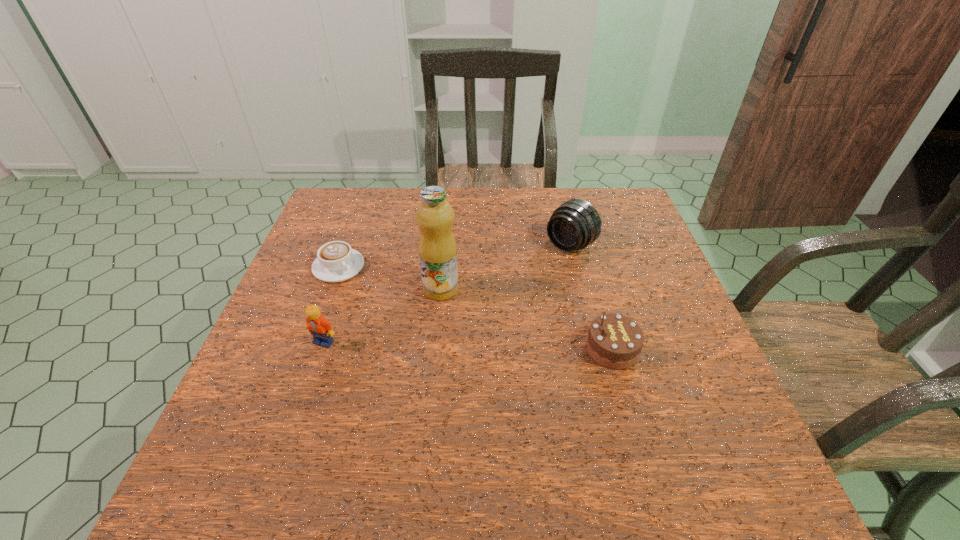
What are the coordinates of `free space located 0.120m with the handle on the right side of the cappuccino` in the screenshot? It's located at (381, 302).

The height and width of the screenshot is (540, 960). What are the coordinates of `vacant area situated 0.170m at the front element of the fourth shortest object` in the screenshot? It's located at (516, 289).

Find the location of a particular element. This screenshot has height=540, width=960. vacant space located at the front element of the fourth shortest object is located at coordinates (459, 334).

This screenshot has height=540, width=960. Find the location of `blank space located 0.210m at the front element of the fourth shortest object`. blank space located 0.210m at the front element of the fourth shortest object is located at coordinates (505, 298).

Identify the location of free location located on the front label of the fruit juice. The width and height of the screenshot is (960, 540). (561, 397).

The width and height of the screenshot is (960, 540). Find the location of `free space located on the front label of the fruit juice`. free space located on the front label of the fruit juice is located at coordinates (489, 332).

I want to click on vacant area situated on the front label of the fruit juice, so click(x=561, y=397).

Where is `object that is at the far edge`? object that is at the far edge is located at coordinates (575, 224).

Image resolution: width=960 pixels, height=540 pixels. Find the location of `Lego that is at the left edge`. Lego that is at the left edge is located at coordinates (320, 328).

Locate an element on the screen. Image resolution: width=960 pixels, height=540 pixels. cappuccino that is at the left edge is located at coordinates click(336, 261).